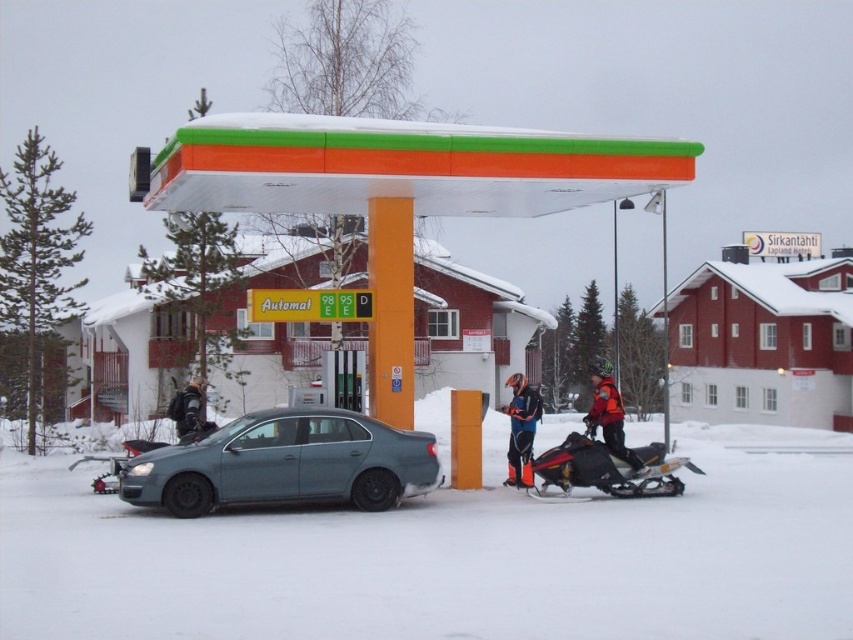
Does slate gray matte sedan at center have a greater width compared to black matte snowmobile at lower left?

Indeed, slate gray matte sedan at center has a greater width compared to black matte snowmobile at lower left.

Is slate gray matte sedan at center positioned in front of black matte snowmobile at lower left?

Yes, it is.

Who is more distant from viewer, (253, 444) or (196, 388)?

The point (196, 388) is behind.

The image size is (853, 640). I want to click on slate gray matte sedan at center, so click(x=285, y=464).

Does point (614, 612) come in front of point (589, 410)?

Yes, point (614, 612) is closer to viewer.

Between white powdery snow at center and orange reflective jacket at center, which one has more height?

Standing taller between the two is orange reflective jacket at center.

Identify the location of white powdery snow at center. The width and height of the screenshot is (853, 640). (450, 556).

Which is in front, point (659, 448) or point (170, 417)?

Point (659, 448)

You are a GUI agent. You are given a task and a screenshot of the screen. Output one action in this format:
    pyautogui.click(x=<x>, y=<y>)
    Task: Click on the black matte snowmobile at lower right
    
    Given the screenshot: What is the action you would take?
    coord(608,467)

The height and width of the screenshot is (640, 853). Identify the location of black matte snowmobile at lower right. (608, 467).